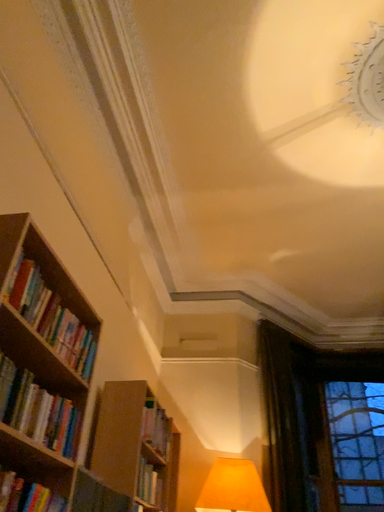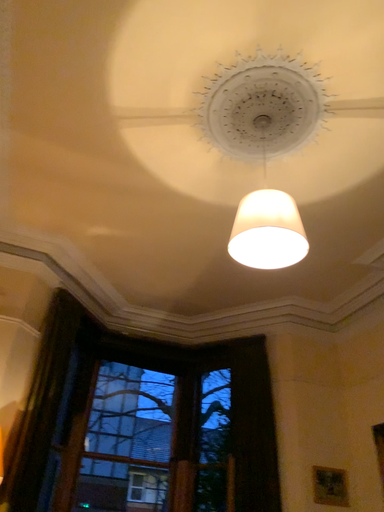
Question: How did the camera likely rotate when shooting the video?

Choices:
 (A) rotated upward
 (B) rotated downward

Answer: (B)